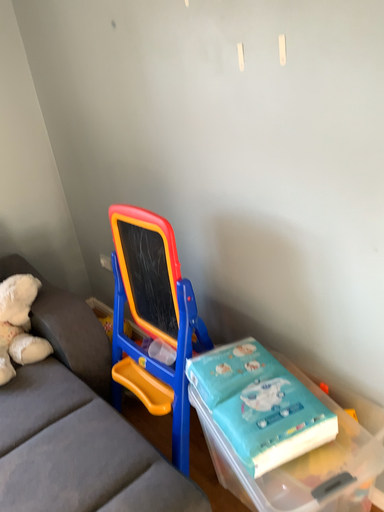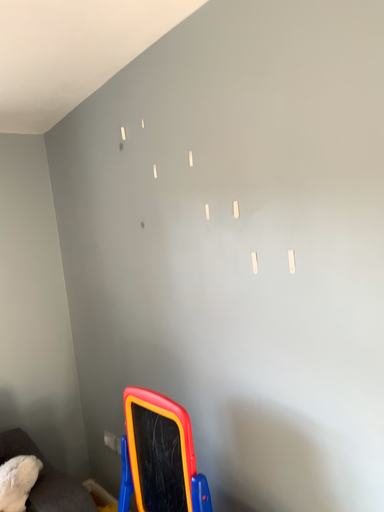
Question: How did the camera likely rotate when shooting the video?

Choices:
 (A) rotated downward
 (B) rotated upward

Answer: (B)